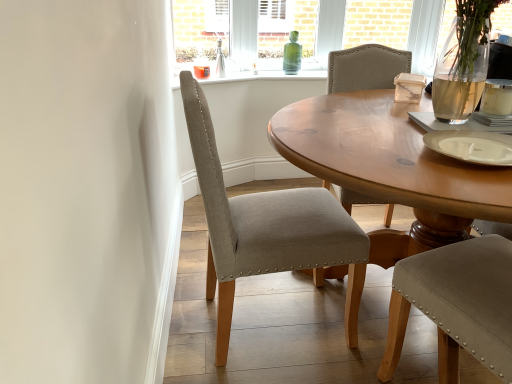
Identify the location of vacant area that is in front of green glass bottle at center. This screenshot has width=512, height=384. pos(288,70).